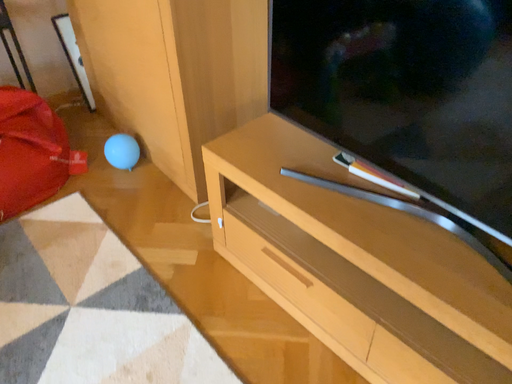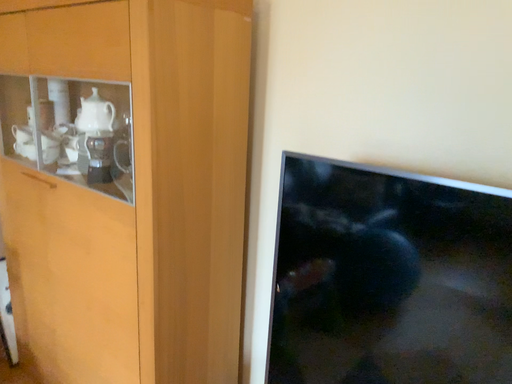
Question: Which way did the camera rotate in the video?

Choices:
 (A) rotated right
 (B) rotated left

Answer: (A)